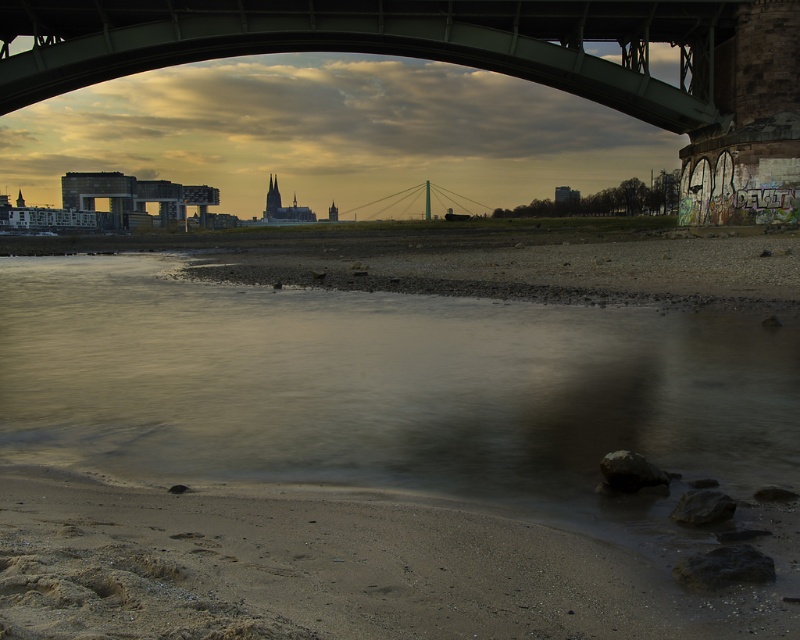
Is brown sand at lower center positioned before green metallic bridge at upper center?

Yes, brown sand at lower center is in front of green metallic bridge at upper center.

Is brown sand at lower center behind green metallic bridge at upper center?

That is False.

Where is `brown sand at lower center`? This screenshot has height=640, width=800. brown sand at lower center is located at coordinates (364, 458).